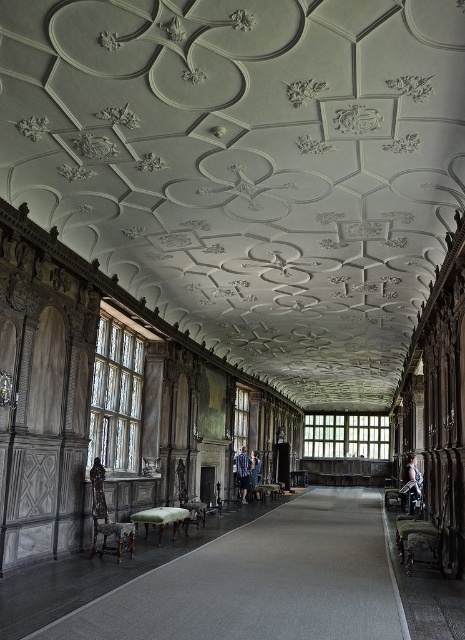
You are a photographer setting up a shoot in this ornately decorated interior. You have a camera with a 1.5 meter wide frame. The smooth skin figure at center and the blue denim jeans at center are both in your shot. Which object is wider and will take up more space in your frame?

The smooth skin figure at center is wider than the blue denim jeans at center, so it will take up more space in the frame.

You are an interior designer inspecting the room. You notice a point marked at coordinates [412,481]. What is located at this point?

The point at coordinates [412,481] marks the location of a smooth skin figure at center.

In the scene shown: You are standing in the room and want to move towards the dark brown leather chair at left. Considering you can walk 3 feet per second, how many seconds will it take you to reach the chair?

The dark brown leather chair at left is 28.74 feet away from the viewer. At a walking speed of 3 feet per second, it would take approximately 9.58 seconds to reach the chair.